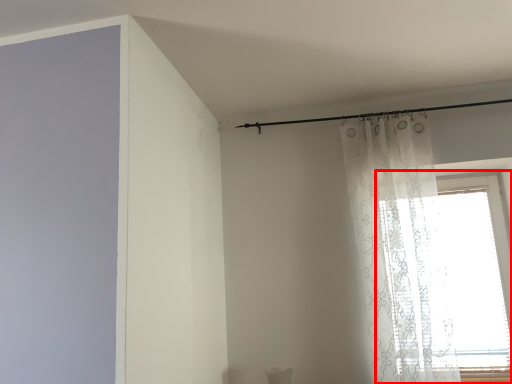
Question: From the image's perspective, where is window (annotated by the red box) located in relation to curtain in the image?

Choices:
 (A) below
 (B) above

Answer: (A)